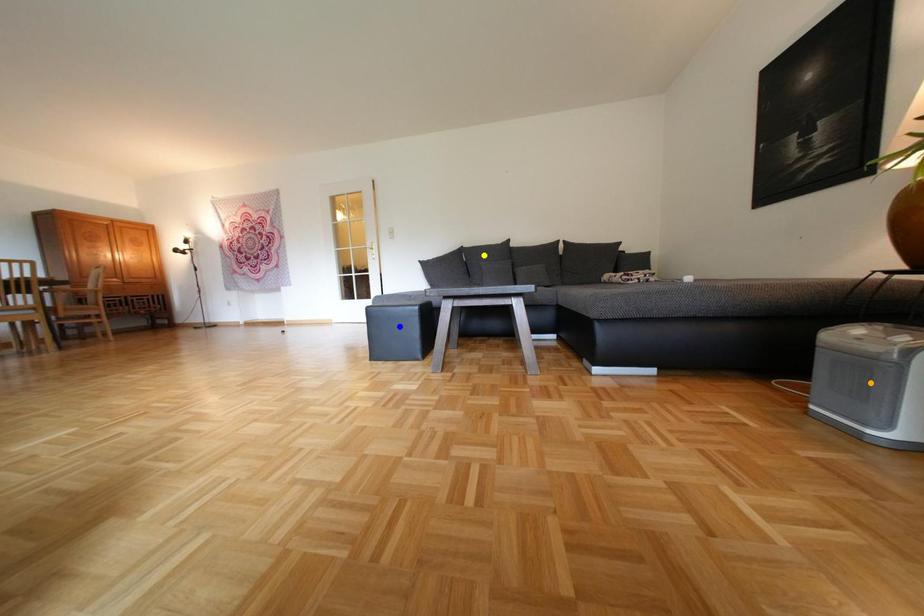
Order these from nearest to farthest:
- blue point
- orange point
- yellow point

yellow point, blue point, orange point